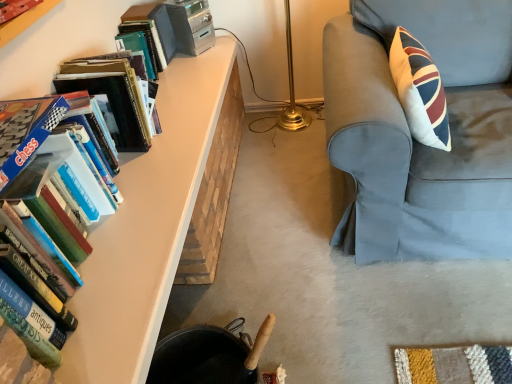
This screenshot has height=384, width=512. I want to click on spots to the right of hardcover book at upper left, which is the first book in top-to-bottom order, so click(x=199, y=67).